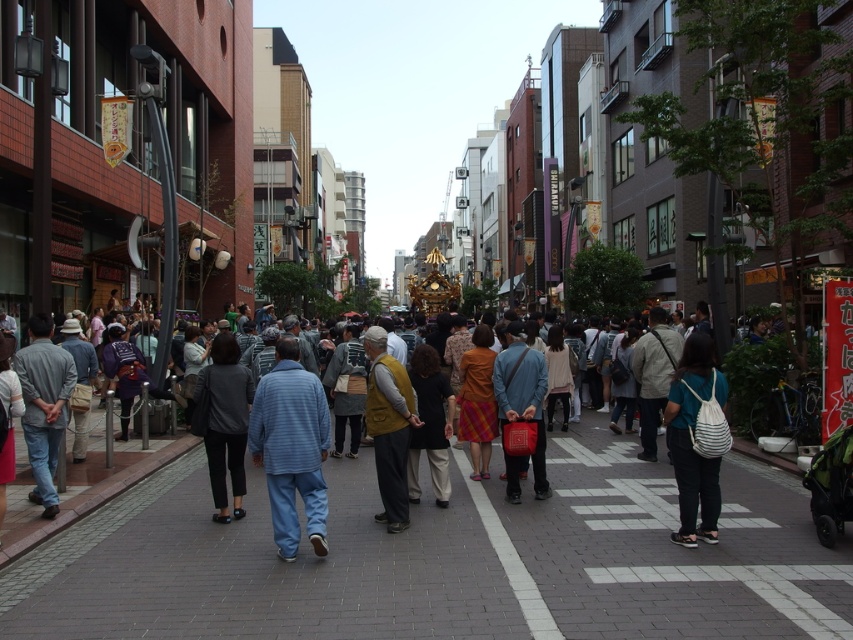
You are a photographer trying to capture a clear shot of the mustard yellow vest at center and the matte red bag at center in the crowd. Since both are at the center, which one is closer to the camera?

The mustard yellow vest at center is in front of the matte red bag at center, so it is closer to the camera.